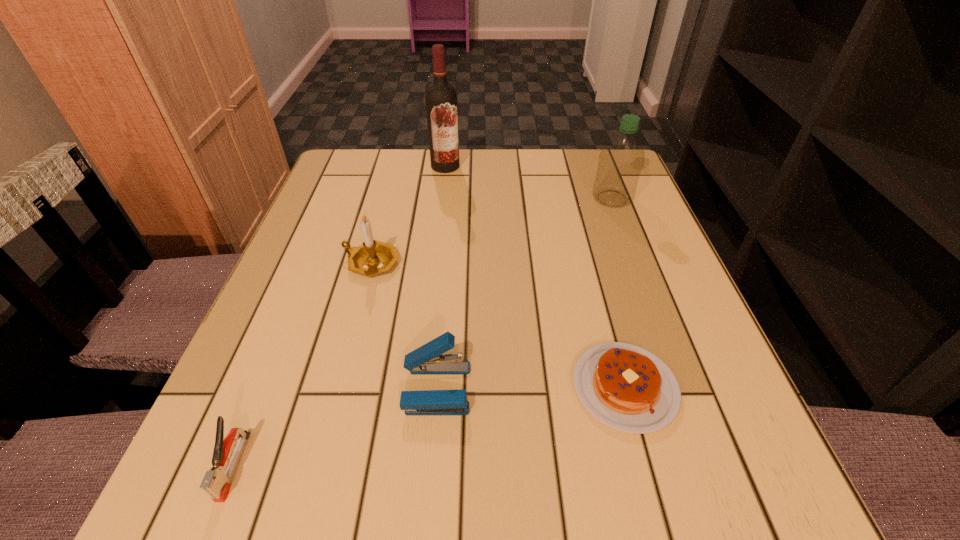
Where is `the farthest object`? The width and height of the screenshot is (960, 540). the farthest object is located at coordinates (441, 97).

I want to click on the tallest object, so click(441, 97).

The width and height of the screenshot is (960, 540). Identify the location of water bottle. (621, 159).

Locate an element on the screen. This screenshot has height=540, width=960. the second tallest object is located at coordinates (621, 159).

In order to click on candle holder in this screenshot , I will do `click(373, 257)`.

This screenshot has width=960, height=540. What are the coordinates of `the third farthest object` in the screenshot? It's located at pyautogui.click(x=373, y=257).

Identify the location of the right stapler. Image resolution: width=960 pixels, height=540 pixels. (428, 359).

Locate an element on the screen. The width and height of the screenshot is (960, 540). the leftmost object is located at coordinates (216, 483).

Locate an element on the screen. This screenshot has width=960, height=540. the nearer stapler is located at coordinates (216, 483).

Where is `the shortest object`? This screenshot has width=960, height=540. the shortest object is located at coordinates (626, 387).